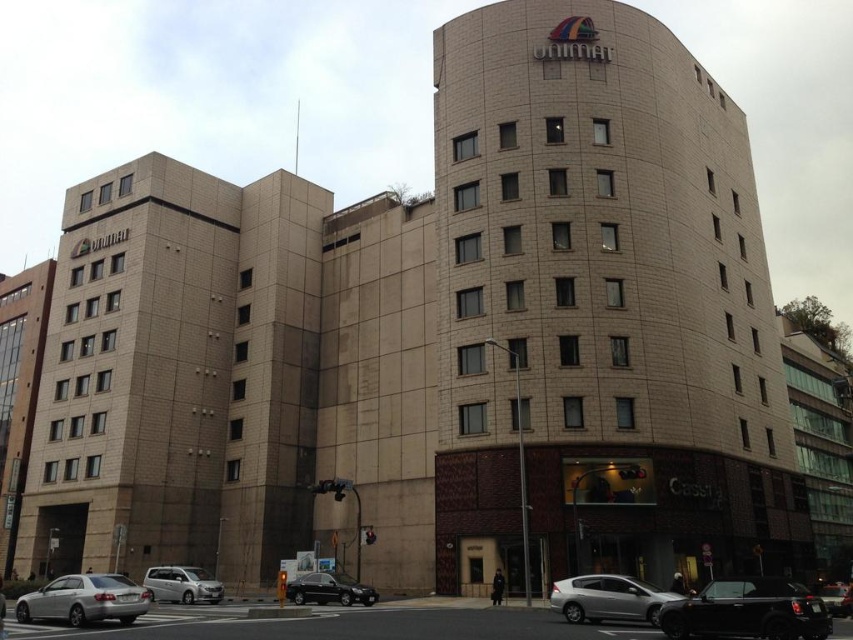
Does silver metallic sedan at lower left have a smaller size compared to shiny black sedan at lower center?

Incorrect, silver metallic sedan at lower left is not smaller in size than shiny black sedan at lower center.

This screenshot has width=853, height=640. In order to click on silver metallic sedan at lower left in this screenshot , I will do `click(84, 600)`.

Is shiny black car at lower right thinner than silver metallic van at center?

Indeed, shiny black car at lower right has a lesser width compared to silver metallic van at center.

Who is positioned more to the right, shiny black car at lower right or silver metallic van at center?

shiny black car at lower right is more to the right.

The image size is (853, 640). What are the coordinates of `shiny black car at lower right` in the screenshot? It's located at tap(747, 611).

I want to click on shiny black car at lower right, so click(747, 611).

Which is behind, point (537, 74) or point (93, 602)?

Point (537, 74)

What are the coordinates of `beige brick building at center` in the screenshot? It's located at (601, 308).